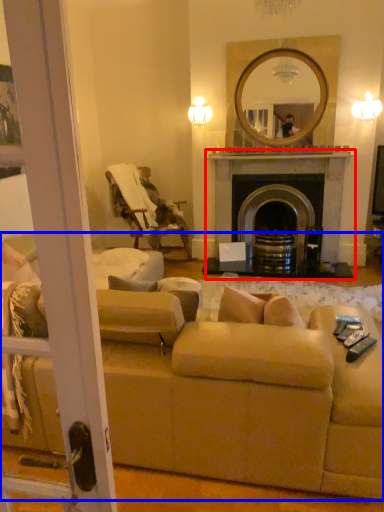
Question: Which object appears closest to the camera in this image, fireplace (highlighted by a red box) or studio couch (highlighted by a blue box)?

Choices:
 (A) fireplace
 (B) studio couch

Answer: (B)